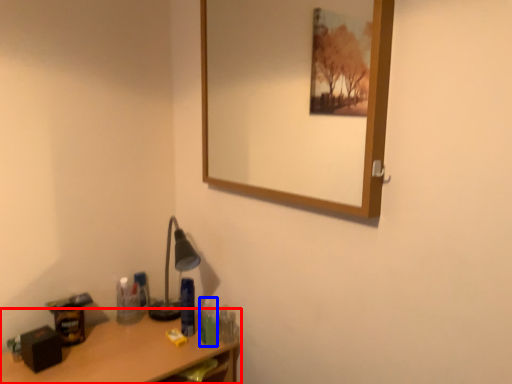
Question: Which of the following is the closest to the observer, desk (highlighted by a red box) or toiletry (highlighted by a blue box)?

Choices:
 (A) desk
 (B) toiletry

Answer: (A)